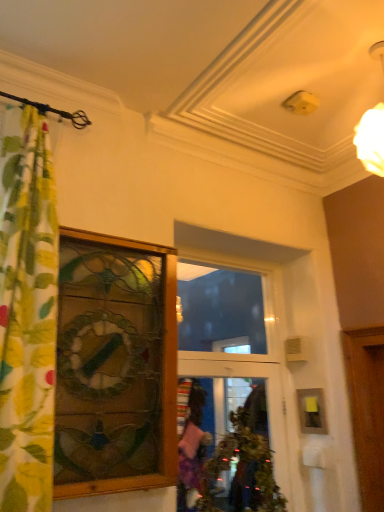
The width and height of the screenshot is (384, 512). What do you see at coordinates (244, 377) in the screenshot? I see `clear glass door at center` at bounding box center [244, 377].

What do you see at coordinates (312, 411) in the screenshot? I see `wooden picture frame at right` at bounding box center [312, 411].

The width and height of the screenshot is (384, 512). Identify the location of transparent glass window at center. (220, 310).

From the image's perspective, would you say wooden picture frame at right is shown under clear glass door at center?

Actually, wooden picture frame at right appears above clear glass door at center in the image.

Is wooden picture frame at right at the right side of clear glass door at center?

Correct, you'll find wooden picture frame at right to the right of clear glass door at center.

From a real-world perspective, is wooden picture frame at right positioned above or below clear glass door at center?

wooden picture frame at right is above clear glass door at center.

This screenshot has height=512, width=384. Identify the location of glass window behind the green floral fabric curtain at left. (220, 310).

Would you say transparent glass window at center is inside or outside green floral fabric curtain at left?

transparent glass window at center is spatially situated outside green floral fabric curtain at left.

Considering the relative sizes of transparent glass window at center and green floral fabric curtain at left in the image provided, is transparent glass window at center taller than green floral fabric curtain at left?

In fact, transparent glass window at center may be shorter than green floral fabric curtain at left.

Considering the positions of objects transparent glass window at center and green floral fabric curtain at left in the image provided, who is in front, transparent glass window at center or green floral fabric curtain at left?

green floral fabric curtain at left.

Who is more distant, green floral fabric curtain at left or clear glass door at center?

clear glass door at center is further away from the camera.

Is green floral fabric curtain at left to the left or to the right of clear glass door at center in the image?

Based on their positions, green floral fabric curtain at left is located to the left of clear glass door at center.

Could you tell me if green floral fabric curtain at left is facing clear glass door at center?

No, green floral fabric curtain at left is not oriented towards clear glass door at center.

How different are the orientations of transparent glass window at center and wooden picture frame at right in degrees?

The angle between the facing direction of transparent glass window at center and the facing direction of wooden picture frame at right is 90.5 degrees.

Does transparent glass window at center lie in front of wooden picture frame at right?

Yes, transparent glass window at center is closer to the viewer.

Is transparent glass window at center facing towards wooden picture frame at right?

No, transparent glass window at center does not turn towards wooden picture frame at right.

From the image's perspective, which object appears higher, transparent glass window at center or wooden picture frame at right?

From the image's view, transparent glass window at center is above.

You are a GUI agent. You are given a task and a screenshot of the screen. Output one action in this format:
    pyautogui.click(x=<x>, y=<y>)
    Task: Click on the curtain lying on the left of wooden stained glass window at left
    The height and width of the screenshot is (512, 384).
    Given the screenshot: What is the action you would take?
    pos(27,311)

Which object is closer to the camera taking this photo, green floral fabric curtain at left or wooden stained glass window at left?

green floral fabric curtain at left is more forward.

Can you confirm if green floral fabric curtain at left is thinner than wooden stained glass window at left?

Incorrect, the width of green floral fabric curtain at left is not less than that of wooden stained glass window at left.

Between green floral fabric curtain at left and wooden stained glass window at left, which one has less height?

With less height is wooden stained glass window at left.

Identify the location of curtain above the transparent glass window at center (from the image's perspective). The width and height of the screenshot is (384, 512). (27, 311).

Is green floral fabric curtain at left completely or partially outside of transparent glass window at center?

Yes, green floral fabric curtain at left is outside of transparent glass window at center.

Who is smaller, green floral fabric curtain at left or transparent glass window at center?

With smaller size is transparent glass window at center.

From a real-world perspective, which object rests below the other?

From a 3D spatial view, clear glass door at center is below.

From their relative heights in the image, would you say clear glass door at center is taller or shorter than green floral fabric curtain at left?

Clearly, clear glass door at center is shorter compared to green floral fabric curtain at left.

Which is in front, clear glass door at center or green floral fabric curtain at left?

green floral fabric curtain at left is in front.

Locate an element on the screen. Image resolution: width=384 pixels, height=512 pixels. curtain on the left of the clear glass door at center is located at coordinates (27, 311).

Where is `door that is on the left side of wooden picture frame at right`? door that is on the left side of wooden picture frame at right is located at coordinates click(244, 377).

Identify the location of glass window behind the green floral fabric curtain at left. (220, 310).

Estimate the real-world distances between objects in this image. Which object is closer to green floral fabric curtain at left, wooden stained glass window at left or clear glass door at center?

Among the two, wooden stained glass window at left is located nearer to green floral fabric curtain at left.

Based on their spatial positions, is transparent glass window at center or wooden picture frame at right closer to green floral fabric curtain at left?

wooden picture frame at right.

From the image, which object appears to be farther from transparent glass window at center, green floral fabric curtain at left or clear glass door at center?

green floral fabric curtain at left lies further to transparent glass window at center than the other object.

When comparing their distances from clear glass door at center, does transparent glass window at center or wooden picture frame at right seem closer?

The object closer to clear glass door at center is wooden picture frame at right.

Looking at the image, which one is located further to green floral fabric curtain at left, wooden picture frame at right or transparent glass window at center?

transparent glass window at center is positioned further to the anchor green floral fabric curtain at left.

Estimate the real-world distances between objects in this image. Which object is further from green floral fabric curtain at left, clear glass door at center or wooden picture frame at right?

wooden picture frame at right.

Consider the image. When comparing their distances from transparent glass window at center, does wooden stained glass window at left or clear glass door at center seem closer?

clear glass door at center is positioned closer to the anchor transparent glass window at center.

From the image, which object appears to be farther from wooden picture frame at right, clear glass door at center or transparent glass window at center?

The object further to wooden picture frame at right is transparent glass window at center.

Image resolution: width=384 pixels, height=512 pixels. I want to click on glass window positioned between green floral fabric curtain at left and wooden picture frame at right from near to far, so click(220, 310).

Locate an element on the screen. The width and height of the screenshot is (384, 512). door between green floral fabric curtain at left and wooden picture frame at right along the z-axis is located at coordinates (244, 377).

You are a GUI agent. You are given a task and a screenshot of the screen. Output one action in this format:
    pyautogui.click(x=<x>, y=<y>)
    Task: Click on the picture frame between transparent glass window at center and clear glass door at center from top to bottom
    This screenshot has width=384, height=512.
    Given the screenshot: What is the action you would take?
    coord(312,411)

Where is `window between green floral fabric curtain at left and wooden picture frame at right in the horizontal direction`? window between green floral fabric curtain at left and wooden picture frame at right in the horizontal direction is located at coordinates (115, 366).